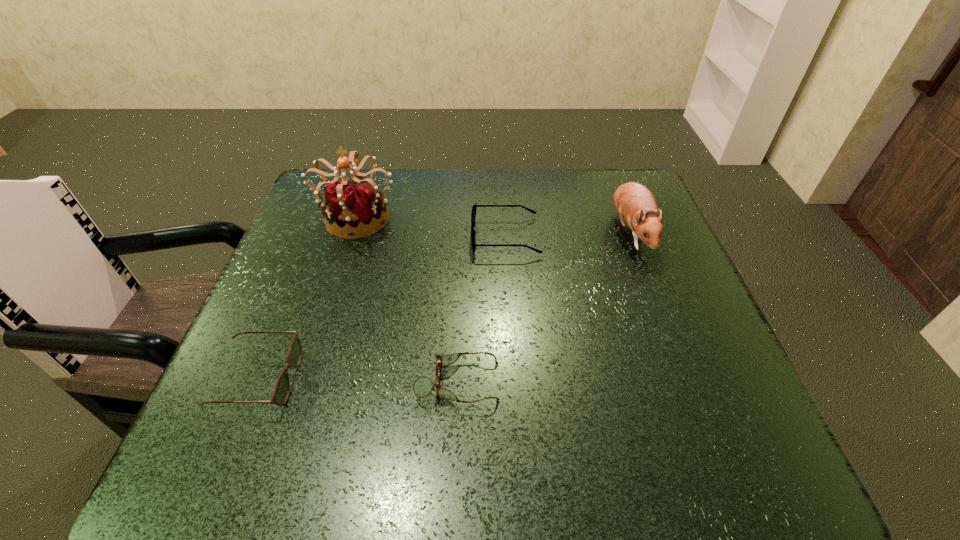
The width and height of the screenshot is (960, 540). Find the location of `object present at the far right corner`. object present at the far right corner is located at coordinates (635, 204).

In the image, there is a desktop. Identify the location of vacant space at the far edge. (512, 188).

Locate an element on the screen. This screenshot has width=960, height=540. free space at the near edge is located at coordinates (502, 444).

This screenshot has height=540, width=960. Identify the location of vacant area at the left edge of the desktop. (311, 338).

Identify the location of blank space at the right edge. (690, 278).

In the image, there is a desktop. Where is `vacant space at the far left corner`? The image size is (960, 540). vacant space at the far left corner is located at coordinates (309, 212).

Where is `vacant region at the near left corner of the desktop`? vacant region at the near left corner of the desktop is located at coordinates (294, 447).

Find the location of `free space at the far right corner of the desktop`. free space at the far right corner of the desktop is located at coordinates tap(597, 202).

Where is `free point between the shortest spectacles and the leftmost spectacles`? free point between the shortest spectacles and the leftmost spectacles is located at coordinates (358, 381).

Find the location of a particular element. unoccupied position between the tiara and the leftmost spectacles is located at coordinates (308, 298).